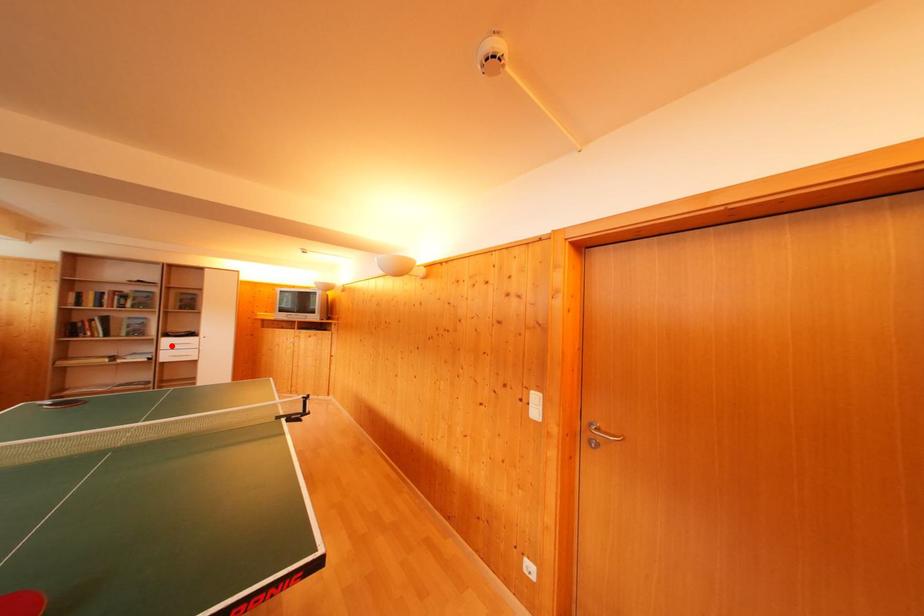
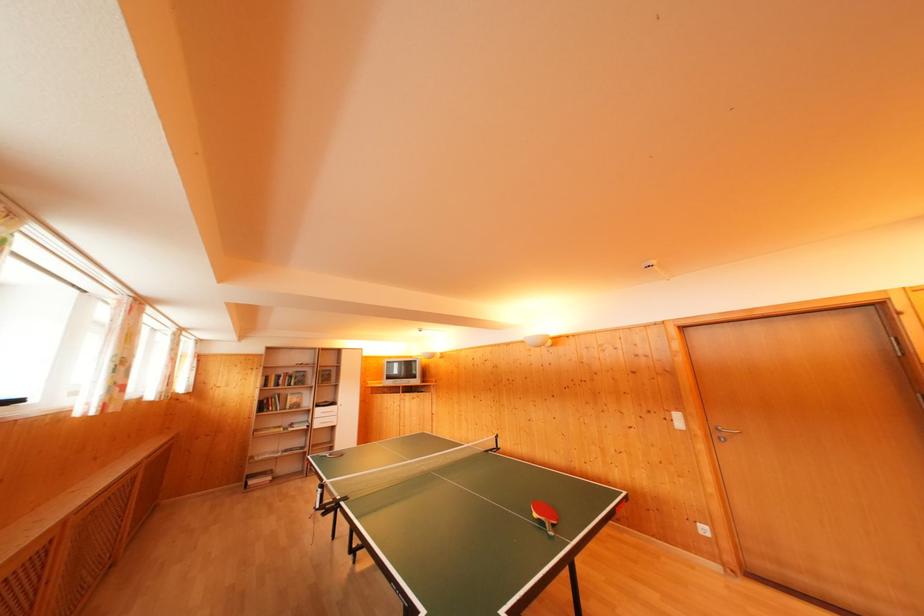
Question: A red point is marked in image1. In image2, is the corresponding 3D point closer to the camera or farther? Reply with the corresponding letter.

Choices:
 (A) The corresponding 3D point is closer.
 (B) The corresponding 3D point is farther.

Answer: (B)